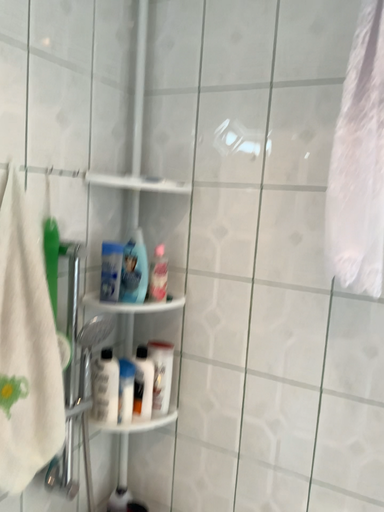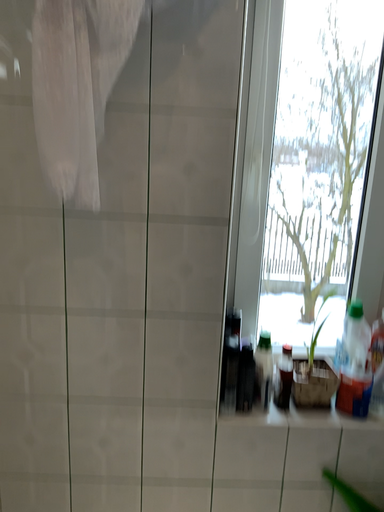
Question: How did the camera likely rotate when shooting the video?

Choices:
 (A) rotated downward
 (B) rotated upward

Answer: (A)